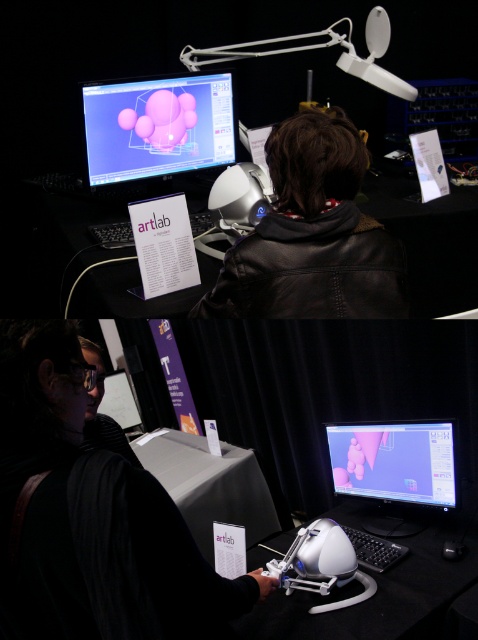
Consider the image. You are an artlab intern who needs to choose between the leather jacket at center and the white matte helmet at center for a project. Which item is bigger?

The leather jacket at center is larger in size than the white matte helmet at center, so the leather jacket at center is bigger.

You are an artist in the artlab needing to place a new object on the desk. Given the current setup, which item, the leather jacket at center or the white matte helmet at center, would you need to move first to make space?

The leather jacket at center is much taller than the white matte helmet at center, so you would need to move the leather jacket at center first to make space.

Looking at this image, you are an art student observing the top section of the workspace. You notice the black matte jacket at center and the matte pink sphere at upper center. Which object is positioned higher in the image?

The matte pink sphere at upper center is positioned higher than the black matte jacket at center, as it is located above it.